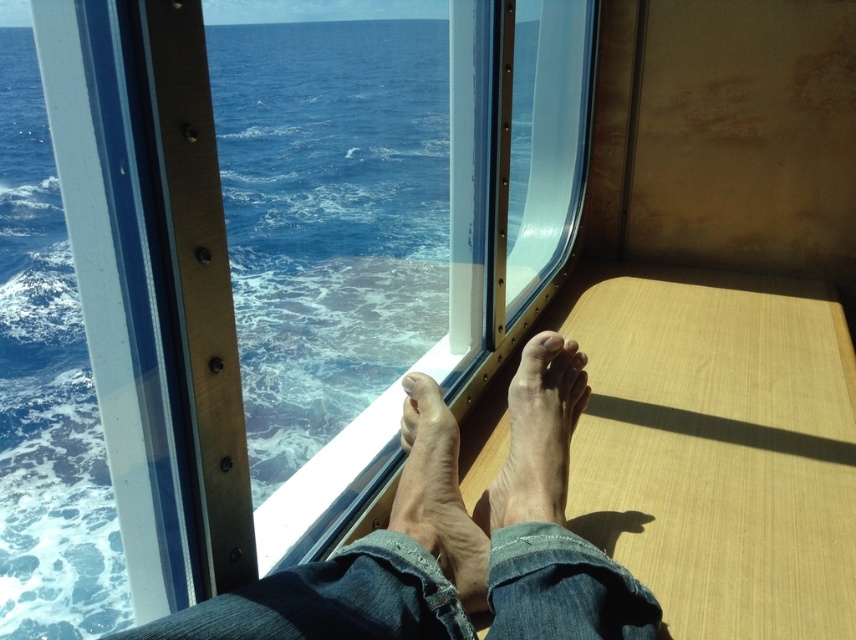
Question: Considering the real-world distances, which object is closest to the dry skin foot at lower center?

Choices:
 (A) smooth skin feet at center
 (B) matte skin toe at center
 (C) pale skin toe at center

Answer: (A)

Question: Among these points, which one is farthest from the camera?

Choices:
 (A) (562, 344)
 (B) (429, 394)

Answer: (A)

Question: Does smooth skin feet at center have a lesser width compared to pale skin toe at center?

Choices:
 (A) yes
 (B) no

Answer: (B)

Question: Is smooth skin feet at center wider than pale skin toe at center?

Choices:
 (A) yes
 (B) no

Answer: (A)

Question: Which object is farther from the camera taking this photo?

Choices:
 (A) matte skin toe at center
 (B) dry skin foot at lower center
 (C) smooth skin foot at center
 (D) pale skin toe at center

Answer: (A)

Question: Can you confirm if dry skin foot at lower center is thinner than matte skin toe at center?

Choices:
 (A) no
 (B) yes

Answer: (A)